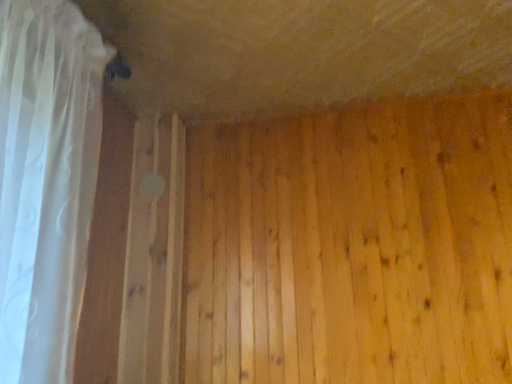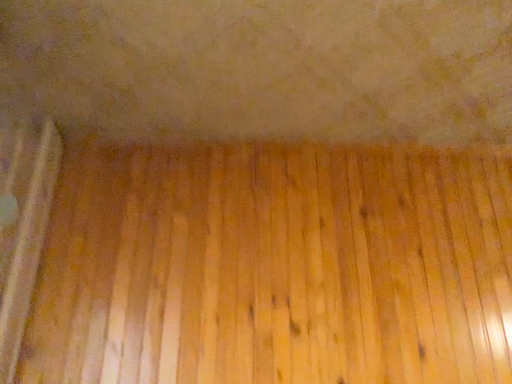
Question: Which way did the camera rotate in the video?

Choices:
 (A) rotated downward
 (B) rotated upward

Answer: (B)